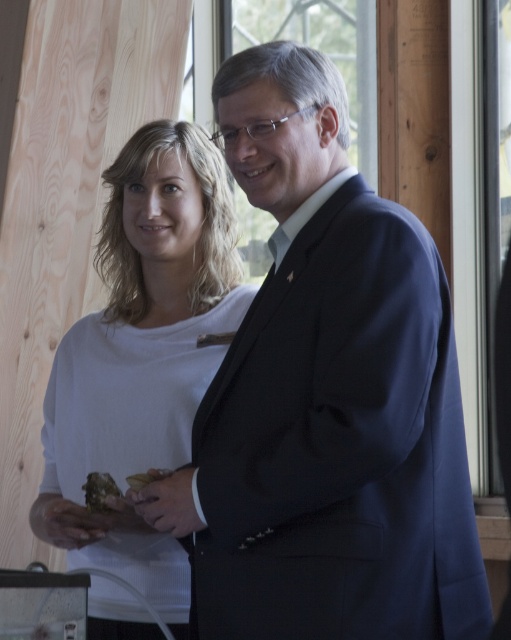
You are a photographer trying to capture a clear photo of the dark blue suit at center and the brown crumbly bread at center. Since both are at the center, which one should you focus on to ensure the other is also in focus? Explain using their positions.

The dark blue suit at center is located above the brown crumbly bread at center. To ensure both are in focus, focus on the dark blue suit at center since it is closer to the camera, and the depth of field will likely include the brown crumbly bread at center below it.

Consider the image. You are a tailor who needs to determine which garment requires more fabric to make between the dark blue suit at center and the white matte sweater at center. Based on the image, which one would you choose?

The dark blue suit at center has a larger width than the white matte sweater at center, so it would require more fabric to make.

You are a tailor measuring the distance between the white matte sweater at center and the brown crumbly bread at center for a fitting. Can you confirm if the distance between them is sufficient to place a 60 cm long measuring tape between them without moving either item?

The distance between the white matte sweater at center and the brown crumbly bread at center is 58.02 centimeters, which is shorter than the 60 cm measuring tape. Therefore, the tape cannot be placed between them without moving either item.